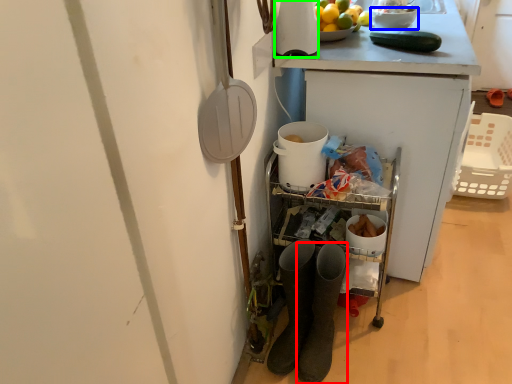
Question: Based on their relative distances, which object is farther from footwear (highlighted by a red box)? Choose from bowl (highlighted by a blue box) and appliance (highlighted by a green box).

Choices:
 (A) bowl
 (B) appliance

Answer: (A)